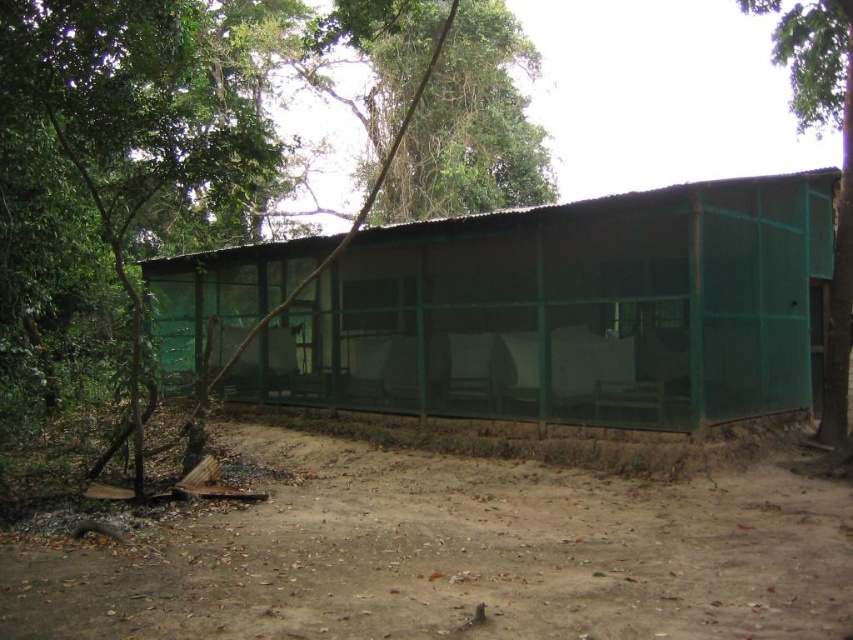
You are planning to set up a picnic blanket between the green mesh hut at center and the green mesh fence at right. The picnic blanket is 5 meters long. Will the blanket fit between them without overlapping either structure?

The green mesh hut at center and green mesh fence at right are 4.96 meters apart. The picnic blanket is 5 meters long, so it will not fit between them without overlapping either structure because the distance is slightly shorter than the blanket length.

You are planning to build a small garden between the brown dirt track at lower center and the green mesh fence at right. Considering their sizes, which object should you place closer to the fence to maximize space for the garden?

The brown dirt track at lower center occupies less space than the green mesh fence at right, so placing the garden closer to the green mesh fence at right would leave more space for the garden.